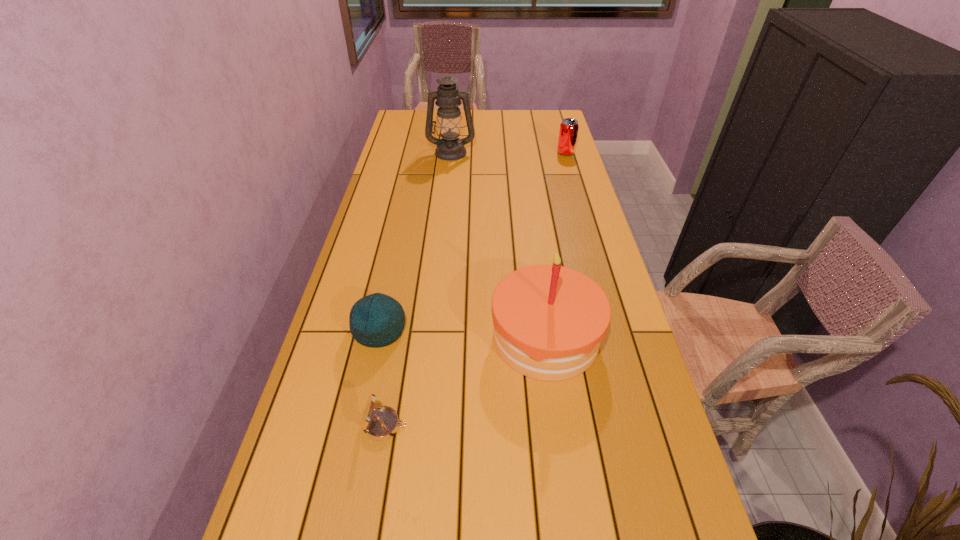
The height and width of the screenshot is (540, 960). In order to click on vacant space that is in between the nearest object and the oil lamp in this screenshot , I will do `click(418, 289)`.

Locate an element on the screen. vacant region between the nearest object and the fourth object from left to right is located at coordinates (466, 381).

The image size is (960, 540). Find the location of `vacant space that's between the beanie and the rightmost object`. vacant space that's between the beanie and the rightmost object is located at coordinates (472, 241).

The width and height of the screenshot is (960, 540). In order to click on vacant area that lies between the compass and the second object from right to left in this screenshot , I will do `click(466, 381)`.

In order to click on empty space between the oil lamp and the birthday cake in this screenshot , I will do `click(498, 245)`.

In order to click on unoccupied area between the oil lamp and the third shortest object in this screenshot , I will do `click(508, 153)`.

Identify the location of vacant space that's between the beanie and the soda can. This screenshot has height=540, width=960. (472, 241).

In order to click on empty space that is in between the birthday cake and the shortest object in this screenshot , I will do `click(466, 381)`.

The width and height of the screenshot is (960, 540). I want to click on free point between the second object from right to left and the oil lamp, so click(498, 245).

This screenshot has width=960, height=540. What are the coordinates of `object that is the closest to the rightmost object` in the screenshot? It's located at (450, 147).